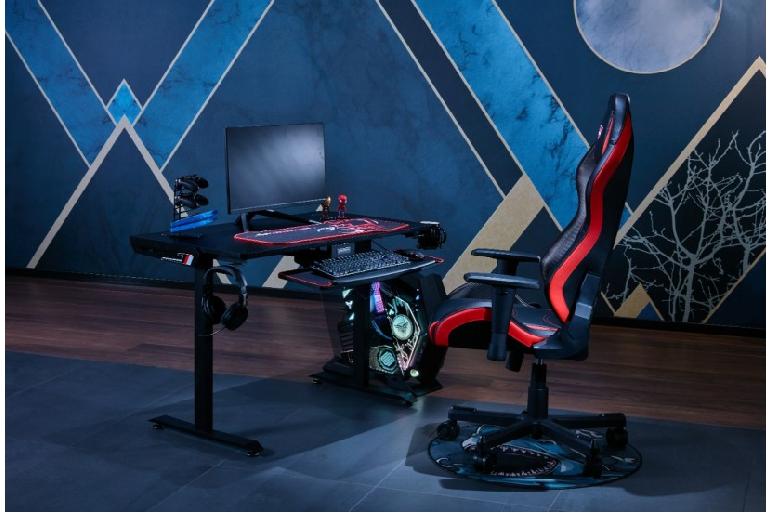
Find the location of a particular element. space where i'd sit in the chair is located at coordinates (528, 315).